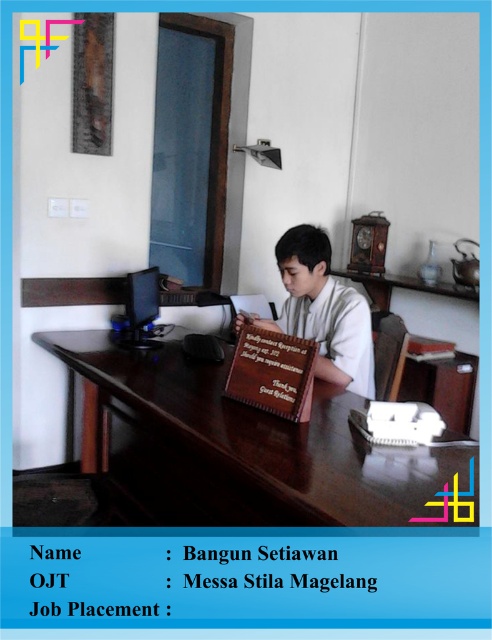
This screenshot has width=492, height=640. Identify the location of black paper at center. (332, 580).

Who is shorter, black paper at center or matte black monitor at center?

With less height is black paper at center.

Is point (303, 552) farther from camera compared to point (135, 308)?

No, (303, 552) is closer to viewer.

The image size is (492, 640). I want to click on black paper at center, so click(332, 580).

Does brown wooden table at center appear under matte black monitor at center?

Yes, brown wooden table at center is below matte black monitor at center.

Between brown wooden table at center and matte black monitor at center, which one is positioned lower?

brown wooden table at center is below.

Where is `brown wooden table at center`? The image size is (492, 640). brown wooden table at center is located at coordinates (268, 440).

Does wooden plaque at center have a smaller size compared to matte black monitor at center?

No.

Which is more to the right, wooden plaque at center or matte black monitor at center?

Positioned to the right is wooden plaque at center.

This screenshot has height=640, width=492. Find the location of `wooden plaque at center`. wooden plaque at center is located at coordinates (321, 310).

Where is `wooden plaque at center`? wooden plaque at center is located at coordinates (321, 310).